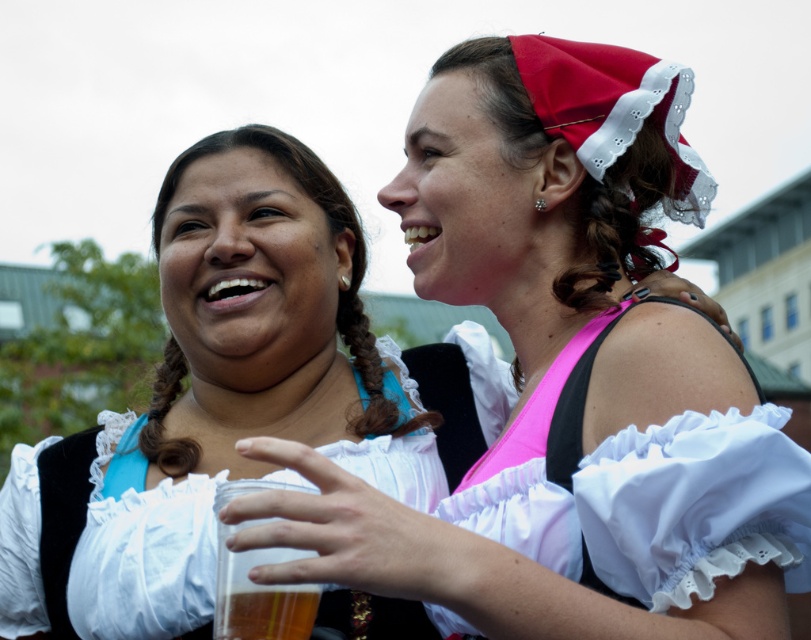
Question: Which of these objects is positioned closest to the translucent plastic cup at center?

Choices:
 (A) matte white blouse at upper center
 (B) pink satin dress at upper right

Answer: (A)

Question: Can you confirm if matte white blouse at upper center is positioned to the right of translucent plastic cup at center?

Choices:
 (A) yes
 (B) no

Answer: (A)

Question: Is matte white blouse at upper center wider than translucent plastic cup at center?

Choices:
 (A) no
 (B) yes

Answer: (B)

Question: Which object is closer to the camera taking this photo?

Choices:
 (A) matte white blouse at upper center
 (B) pink satin dress at upper right
 (C) translucent plastic cup at center

Answer: (B)

Question: Does matte white blouse at upper center have a lesser width compared to translucent plastic cup at center?

Choices:
 (A) no
 (B) yes

Answer: (A)

Question: Which object is closer to the camera taking this photo?

Choices:
 (A) translucent plastic cup at center
 (B) matte white blouse at upper center
 (C) pink satin dress at upper right

Answer: (C)